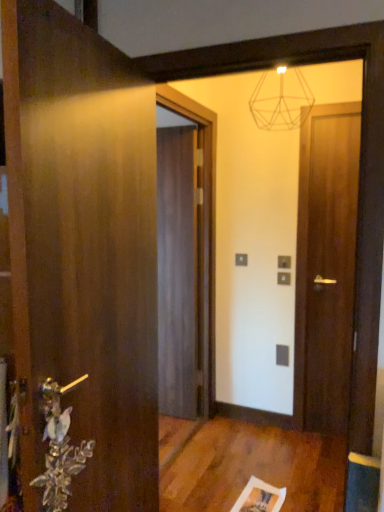
Question: From a real-world perspective, is silver metallic door handle at lower left on wooden door at left, the 3th door when ordered from back to front?

Choices:
 (A) yes
 (B) no

Answer: (B)

Question: Does silver metallic door handle at lower left come behind wooden door at left, the 3th door positioned from the right?

Choices:
 (A) no
 (B) yes

Answer: (B)

Question: Is silver metallic door handle at lower left to the left of wooden door at left, the 3th door positioned from the right, from the viewer's perspective?

Choices:
 (A) no
 (B) yes

Answer: (B)

Question: Can you confirm if silver metallic door handle at lower left is positioned to the right of wooden door at left, the 1th door viewed from the front?

Choices:
 (A) yes
 (B) no

Answer: (B)

Question: Is wooden door at left, the 1th door in the left-to-right sequence, at the back of silver metallic door handle at lower left?

Choices:
 (A) yes
 (B) no

Answer: (A)

Question: Visually, is dark wood door at center, the second door positioned from the right, positioned to the left or to the right of silver metallic door handle at lower left?

Choices:
 (A) left
 (B) right

Answer: (B)

Question: From a real-world perspective, is dark wood door at center, placed as the first door when sorted from back to front, positioned above or below silver metallic door handle at lower left?

Choices:
 (A) below
 (B) above

Answer: (B)

Question: Is dark wood door at center, which is the third door in front-to-back order, spatially inside silver metallic door handle at lower left, or outside of it?

Choices:
 (A) inside
 (B) outside

Answer: (B)

Question: Is point (190, 371) positioned closer to the camera than point (49, 466)?

Choices:
 (A) closer
 (B) farther

Answer: (B)

Question: Choose the correct answer: Is dark wood door at center, placed as the second door when sorted from left to right, inside matte dark wood door at right, the 1th door viewed from the right, or outside it?

Choices:
 (A) outside
 (B) inside

Answer: (A)

Question: Is dark wood door at center, the second door positioned from the right, to the left or to the right of matte dark wood door at right, the 1th door viewed from the right, in the image?

Choices:
 (A) left
 (B) right

Answer: (A)

Question: From a real-world perspective, relative to matte dark wood door at right, arranged as the third door when viewed from the left, is dark wood door at center, placed as the first door when sorted from back to front, vertically above or below?

Choices:
 (A) above
 (B) below

Answer: (B)

Question: Is dark wood door at center, placed as the second door when sorted from left to right, in front of or behind matte dark wood door at right, the 1th door viewed from the right, in the image?

Choices:
 (A) behind
 (B) front

Answer: (A)

Question: In the image, is matte dark wood door at right, arranged as the third door when viewed from the left, positioned in front of or behind dark wood door at center, placed as the second door when sorted from left to right?

Choices:
 (A) behind
 (B) front

Answer: (B)

Question: Considering the positions of matte dark wood door at right, arranged as the third door when viewed from the left, and dark wood door at center, which is the third door in front-to-back order, in the image, is matte dark wood door at right, arranged as the third door when viewed from the left, wider or thinner than dark wood door at center, which is the third door in front-to-back order,?

Choices:
 (A) wide
 (B) thin

Answer: (B)